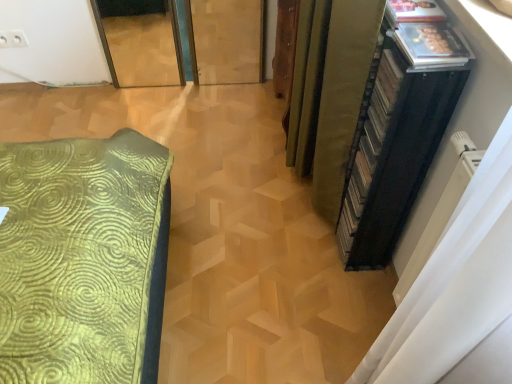
The width and height of the screenshot is (512, 384). Identify the location of vacant space underneath green fabric curtain at right (from a real-world perspective). (300, 195).